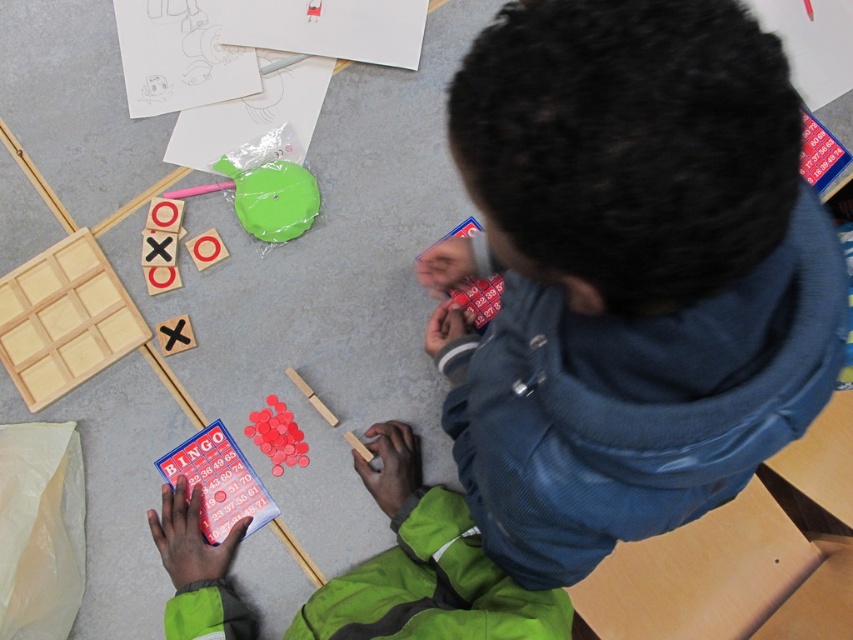
Question: From the image, what is the correct spatial relationship of blue corduroy jacket at upper right in relation to smooth red bingo chips at center?

Choices:
 (A) right
 (B) left

Answer: (A)

Question: Which object is positioned closest to the matte green circle at upper center?

Choices:
 (A) green plastic lid at upper center
 (B) blue corduroy jacket at upper right
 (C) smooth red bingo chips at center

Answer: (A)

Question: Estimate the real-world distances between objects in this image. Which object is farther from the blue corduroy jacket at upper right?

Choices:
 (A) smooth red bingo chips at center
 (B) matte green circle at upper center
 (C) green plastic lid at upper center

Answer: (B)

Question: Can you confirm if green plastic lid at upper center is smaller than smooth red bingo chips at center?

Choices:
 (A) yes
 (B) no

Answer: (B)

Question: Is blue corduroy jacket at upper right smaller than green plastic lid at upper center?

Choices:
 (A) yes
 (B) no

Answer: (B)

Question: Among these objects, which one is nearest to the camera?

Choices:
 (A) green plastic lid at upper center
 (B) smooth red bingo chips at center

Answer: (B)